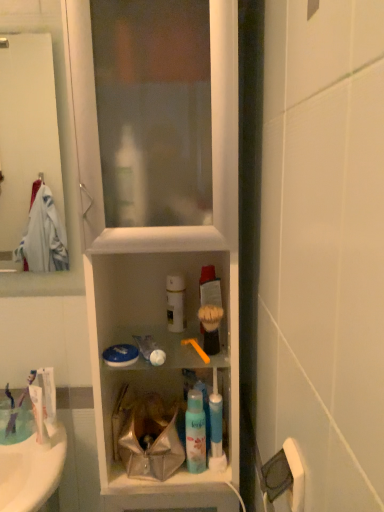
Question: Choose the correct answer: Is white matte spray can at center inside translucent plastic mouthwash at center or outside it?

Choices:
 (A) outside
 (B) inside

Answer: (A)

Question: In the image, is white matte spray can at center positioned in front of or behind translucent plastic mouthwash at center?

Choices:
 (A) behind
 (B) front

Answer: (A)

Question: Which is farther from the translucent plastic mouthwash at center?

Choices:
 (A) orange plastic toothbrush at center
 (B) white matte toothpaste at lower left, which appears as the second toothpaste when viewed from the back
 (C) white matte spray can at center
 (D) white plastic cabinet at center
 (E) white glossy towel at upper left

Answer: (E)

Question: Which object is positioned closest to the translucent plastic mouthwash at center?

Choices:
 (A) white matte toothpaste at lower left, the 1th toothpaste when ordered from front to back
 (B) white glossy tube at left, which is counted as the second toothpaste, starting from the front
 (C) white plastic cabinet at center
 (D) white glossy towel at upper left
 (E) orange plastic toothbrush at center

Answer: (E)